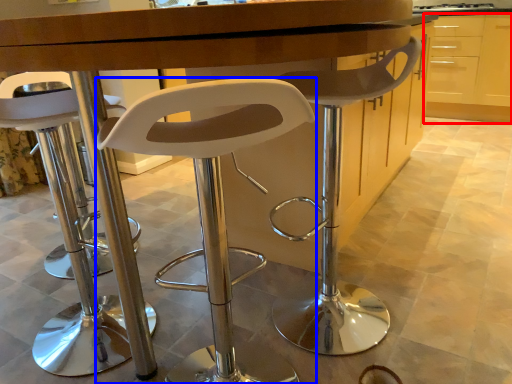
Question: Which point is closer to the camera, cabinetry (highlighted by a red box) or chair (highlighted by a blue box)?

Choices:
 (A) cabinetry
 (B) chair

Answer: (B)